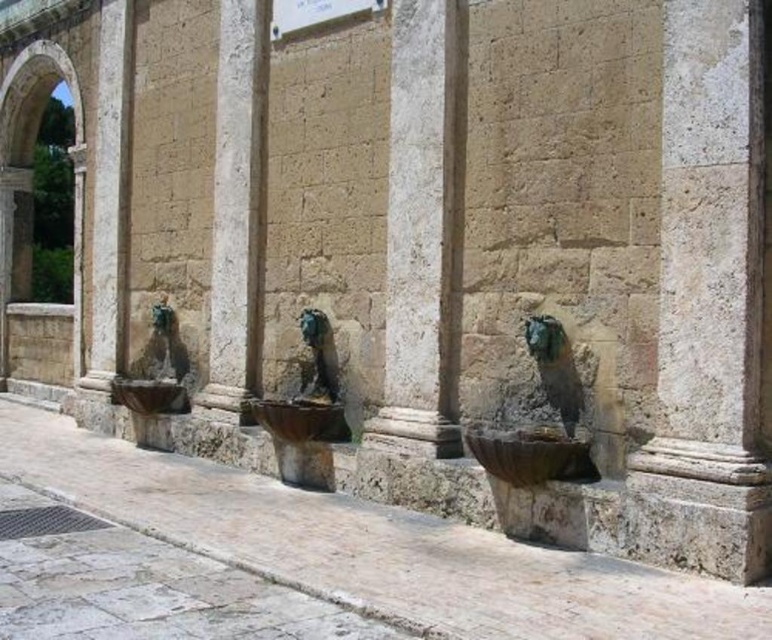
Is point (726, 164) more distant than point (174, 353)?

No, (726, 164) is in front of (174, 353).

Is smooth stone column at center wider than green stone fountain at center?

Indeed, smooth stone column at center has a greater width compared to green stone fountain at center.

Is point (669, 195) behind point (154, 352)?

No, (669, 195) is closer to viewer.

In order to click on smooth stone column at center in this screenshot , I will do `click(706, 305)`.

From the picture: Is smooth stone pillar at center wider than stone archway at upper left?

Correct, the width of smooth stone pillar at center exceeds that of stone archway at upper left.

Is smooth stone pillar at center positioned before stone archway at upper left?

That is True.

What do you see at coordinates (236, 209) in the screenshot?
I see `smooth stone pillar at center` at bounding box center [236, 209].

Identify the location of smooth stone pillar at center. (236, 209).

Measure the distance between green patina stone lion at center and green stone fountain at center.

green patina stone lion at center and green stone fountain at center are 3.22 meters apart.

Between point (310, 384) and point (171, 378), which one is positioned in front?

Point (310, 384)

At what (x,y) coordinates should I click in order to perform the action: click on green patina stone lion at center. Please return your answer as a coordinate pair (x, y). The width and height of the screenshot is (772, 640). Looking at the image, I should click on (315, 355).

At what (x,y) coordinates should I click in order to perform the action: click on green patina stone lion at center. Please return your answer as a coordinate pair (x, y). The height and width of the screenshot is (640, 772). Looking at the image, I should click on (315, 355).